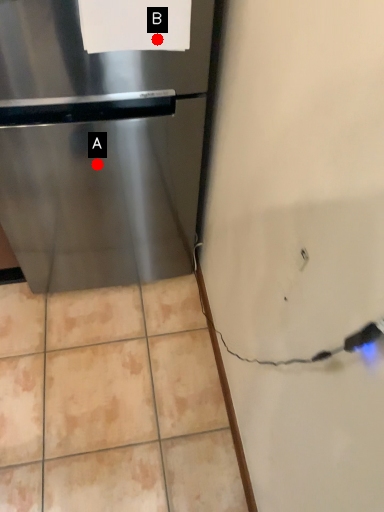
Question: Two points are circled on the image, labeled by A and B beside each circle. Which point appears closest to the camera in this image?

Choices:
 (A) A is closer
 (B) B is closer

Answer: (B)